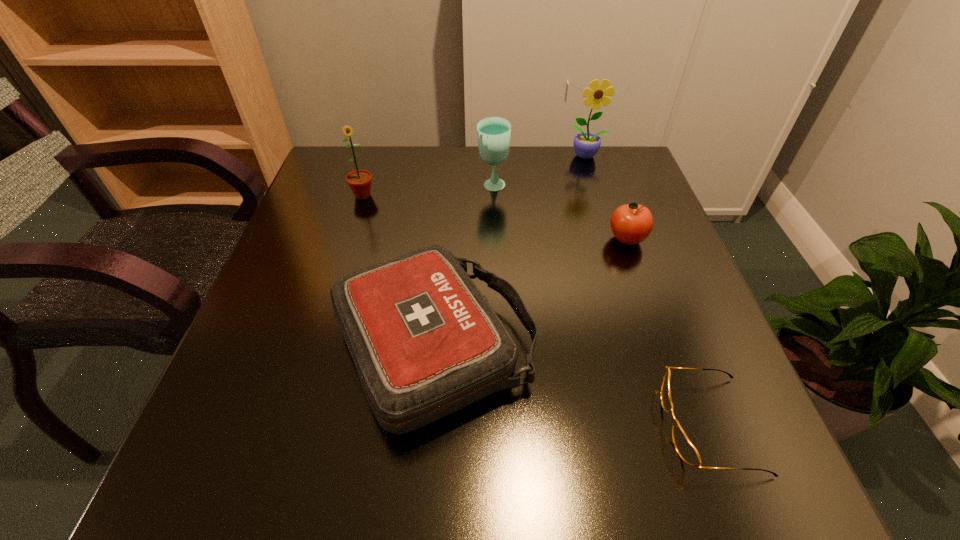
This screenshot has width=960, height=540. I want to click on vacant space at the right edge of the desktop, so click(659, 393).

What are the coordinates of `free location at the far left corner` in the screenshot? It's located at (357, 154).

This screenshot has height=540, width=960. I want to click on free space at the near left corner, so click(215, 492).

You are a GUI agent. You are given a task and a screenshot of the screen. Output one action in this format:
    pyautogui.click(x=<x>, y=<y>)
    Task: Click on the vacant space at the near right corner of the desktop
    The width and height of the screenshot is (960, 540).
    Given the screenshot: What is the action you would take?
    pyautogui.click(x=704, y=490)

This screenshot has width=960, height=540. Identify the location of vacant area between the first-aid kit and the right sunflower. (510, 252).

Find the location of a particular element. The height and width of the screenshot is (540, 960). vacant space that is in between the apple and the shortest object is located at coordinates (668, 332).

The width and height of the screenshot is (960, 540). I want to click on empty space that is in between the apple and the nearer sunflower, so click(494, 217).

The height and width of the screenshot is (540, 960). Find the location of `unoccupied area between the first-aid kit and the farther sunflower`. unoccupied area between the first-aid kit and the farther sunflower is located at coordinates (510, 252).

Locate an element on the screen. The width and height of the screenshot is (960, 540). vacant point located between the glass and the left sunflower is located at coordinates (428, 191).

You are a GUI agent. You are given a task and a screenshot of the screen. Output one action in this format:
    pyautogui.click(x=<x>, y=<y>)
    Task: Click on the unoccupied area between the farthest object and the glass
    This screenshot has width=960, height=540.
    Given the screenshot: What is the action you would take?
    pyautogui.click(x=540, y=172)